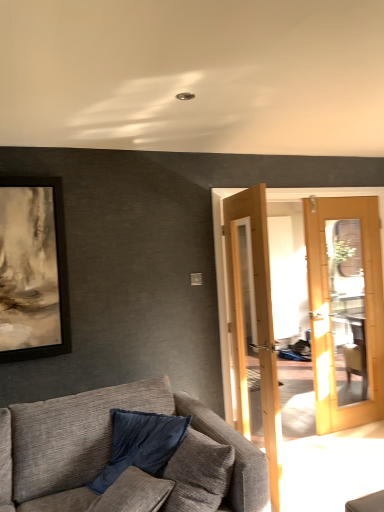
The width and height of the screenshot is (384, 512). Describe the element at coordinates (130, 466) in the screenshot. I see `textured gray couch at lower left` at that location.

Image resolution: width=384 pixels, height=512 pixels. In order to click on textured gray couch at lower left in this screenshot , I will do `click(130, 466)`.

What is the approximate height of velvet blue pillow at lower left?

velvet blue pillow at lower left is 21.19 inches tall.

Measure the distance between point (145, 431) and camera.

The depth of point (145, 431) is 2.38 meters.

What is the approximate width of velvet blue pillow at lower left?

15.60 inches.

This screenshot has height=512, width=384. Identify the location of velvet blue pillow at lower left. (140, 444).

What do you see at coordinates (140, 444) in the screenshot? The width and height of the screenshot is (384, 512). I see `velvet blue pillow at lower left` at bounding box center [140, 444].

Locate an element on the screen. The width and height of the screenshot is (384, 512). textured gray couch at lower left is located at coordinates (130, 466).

In the image, is velvet blue pillow at lower left on the left side or the right side of textured gray couch at lower left?

velvet blue pillow at lower left is to the right of textured gray couch at lower left.

Considering the positions of objects velvet blue pillow at lower left and textured gray couch at lower left in the image provided, who is behind, velvet blue pillow at lower left or textured gray couch at lower left?

velvet blue pillow at lower left is further away from the camera.

Which point is more distant from viewer, (99, 474) or (110, 437)?

Point (110, 437)

From the image's perspective, does velvet blue pillow at lower left appear lower than textured gray couch at lower left?

No.

From a real-world perspective, is velvet blue pillow at lower left beneath textured gray couch at lower left?

No.

Which object is thinner, velvet blue pillow at lower left or textured gray couch at lower left?

velvet blue pillow at lower left.

Is velvet blue pillow at lower left taller than textured gray couch at lower left?

In fact, velvet blue pillow at lower left may be shorter than textured gray couch at lower left.

Who is bigger, velvet blue pillow at lower left or textured gray couch at lower left?

textured gray couch at lower left is bigger.

Which is correct: velvet blue pillow at lower left is inside textured gray couch at lower left, or outside of it?

velvet blue pillow at lower left is spatially positioned inside textured gray couch at lower left.

Is velvet blue pillow at lower left far from textured gray couch at lower left?

They are positioned close to each other.

Could you tell me if velvet blue pillow at lower left is turned towards textured gray couch at lower left?

Yes, velvet blue pillow at lower left faces towards textured gray couch at lower left.

How many degrees apart are the facing directions of velvet blue pillow at lower left and textured gray couch at lower left?

The angle between the facing direction of velvet blue pillow at lower left and the facing direction of textured gray couch at lower left is 61.7 degrees.

You are a GUI agent. You are given a task and a screenshot of the screen. Output one action in this format:
    pyautogui.click(x=<x>, y=<y>)
    Task: Click on the studio couch lying in front of the velvet blue pillow at lower left
    The width and height of the screenshot is (384, 512).
    Given the screenshot: What is the action you would take?
    pyautogui.click(x=130, y=466)

Would you say textured gray couch at lower left is to the left or to the right of velvet blue pillow at lower left in the picture?

From the image, it's evident that textured gray couch at lower left is to the left of velvet blue pillow at lower left.

Between textured gray couch at lower left and velvet blue pillow at lower left, which one is positioned in front?

textured gray couch at lower left.

Does point (123, 489) come behind point (107, 464)?

No, it is in front of (107, 464).

From the image's perspective, which one is positioned lower, textured gray couch at lower left or velvet blue pillow at lower left?

textured gray couch at lower left.

From a real-world perspective, is textured gray couch at lower left above or below velvet blue pillow at lower left?

Clearly, from a real-world perspective, textured gray couch at lower left is below velvet blue pillow at lower left.

Which object is wider, textured gray couch at lower left or velvet blue pillow at lower left?

textured gray couch at lower left.

Does textured gray couch at lower left have a greater height compared to velvet blue pillow at lower left?

Yes, textured gray couch at lower left is taller than velvet blue pillow at lower left.

Does textured gray couch at lower left have a smaller size compared to velvet blue pillow at lower left?

Incorrect, textured gray couch at lower left is not smaller in size than velvet blue pillow at lower left.

Can velvet blue pillow at lower left be found inside textured gray couch at lower left?

Yes, textured gray couch at lower left contains velvet blue pillow at lower left.

Is textured gray couch at lower left placed right next to velvet blue pillow at lower left?

textured gray couch at lower left and velvet blue pillow at lower left are clearly separated.

Looking at this image, could you tell me if textured gray couch at lower left is facing velvet blue pillow at lower left?

Yes, textured gray couch at lower left is oriented towards velvet blue pillow at lower left.

What's the angular difference between textured gray couch at lower left and velvet blue pillow at lower left's facing directions?

The facing directions of textured gray couch at lower left and velvet blue pillow at lower left are 61.7 degrees apart.

Find the location of `pillow on the right of textured gray couch at lower left`. pillow on the right of textured gray couch at lower left is located at coordinates (140, 444).

At what (x,y) coordinates should I click in order to perform the action: click on pillow that is above the textured gray couch at lower left (from a real-world perspective). Please return your answer as a coordinate pair (x, y). This screenshot has height=512, width=384. Looking at the image, I should click on (140, 444).

I want to click on studio couch located below the velvet blue pillow at lower left (from the image's perspective), so click(x=130, y=466).